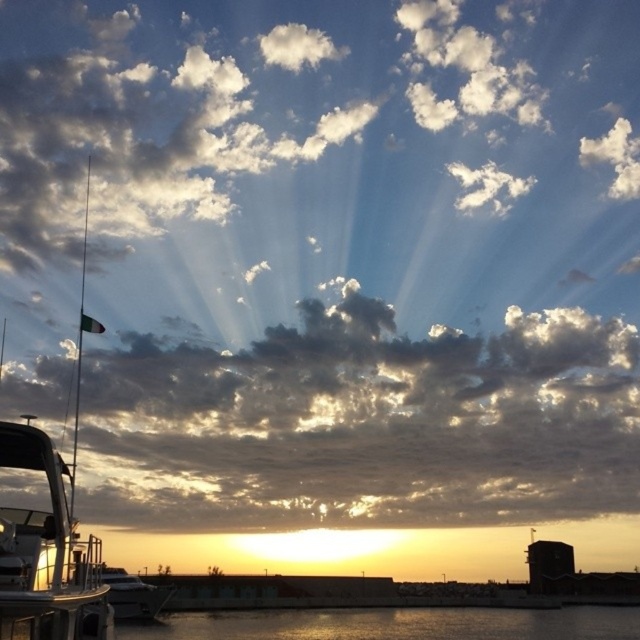
You are standing on the shore looking at the cloudy sky at left and the shiny silver boat at left. Which object is closer to you?

The cloudy sky at left is closer to you because it is further to the viewer than the shiny silver boat at left.

You are a photographer trying to capture the sunset scene. You notice the white glossy boat at left and the shiny silver boat at lower left. Which boat should you focus on if you want to include both boats in your shot without cropping either of them?

The white glossy boat at left is to the left of the shiny silver boat at lower left, so focusing on the white glossy boat at left would allow you to include both boats in the frame without cropping either of them.

You are standing on the dock and see the glistening silver water at lower center and the shiny silver boat at lower left. Which object is positioned to the right of the other?

The glistening silver water at lower center is positioned to the right of the shiny silver boat at lower left.